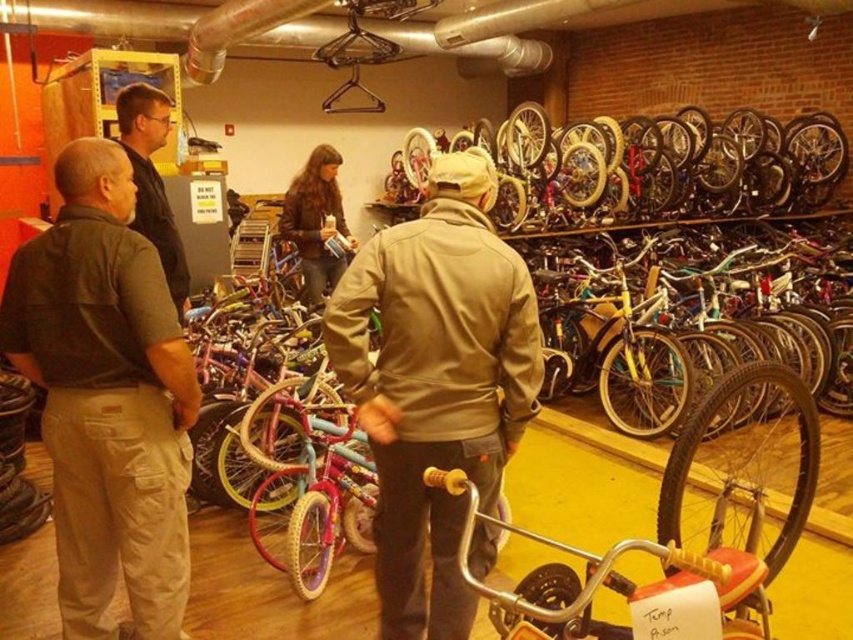
Does tan softshell jacket at center appear under dark brown leather jacket at left?

Correct, tan softshell jacket at center is located below dark brown leather jacket at left.

Can you confirm if tan softshell jacket at center is wider than dark brown leather jacket at left?

Yes, tan softshell jacket at center is wider than dark brown leather jacket at left.

Is point (485, 321) closer to viewer compared to point (158, 205)?

Yes, point (485, 321) is in front of point (158, 205).

Find the location of `tan softshell jacket at center`. tan softshell jacket at center is located at coordinates (436, 381).

Is point (59, 612) positioned before point (463, 298)?

That is False.

Is point (160, 336) farther from viewer compared to point (438, 493)?

No, it is in front of (438, 493).

Does point (114, 157) come farther from viewer compared to point (378, 595)?

No.

Locate an element on the screen. The height and width of the screenshot is (640, 853). dark brown cargo pants at left is located at coordinates (106, 397).

Who is higher up, dark brown cargo pants at left or dark brown leather jacket at left?

Positioned higher is dark brown leather jacket at left.

Can you confirm if dark brown cargo pants at left is bigger than dark brown leather jacket at left?

Yes, dark brown cargo pants at left is bigger than dark brown leather jacket at left.

Where is `dark brown cargo pants at left`? This screenshot has width=853, height=640. dark brown cargo pants at left is located at coordinates (106, 397).

Find the location of a particular element. The image size is (853, 640). dark brown cargo pants at left is located at coordinates (106, 397).